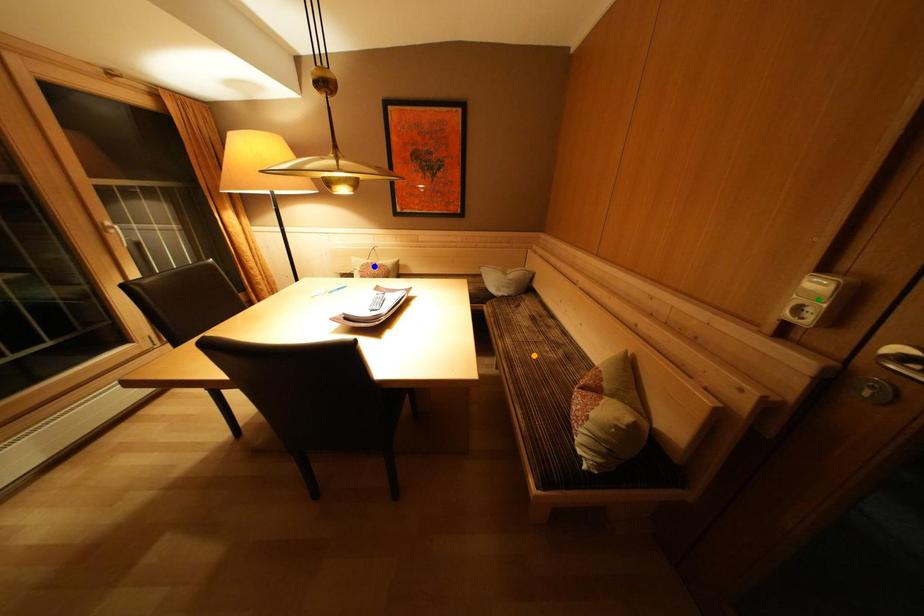
Order these from nearest to farthest:
orange point | blue point | green point

blue point < orange point < green point